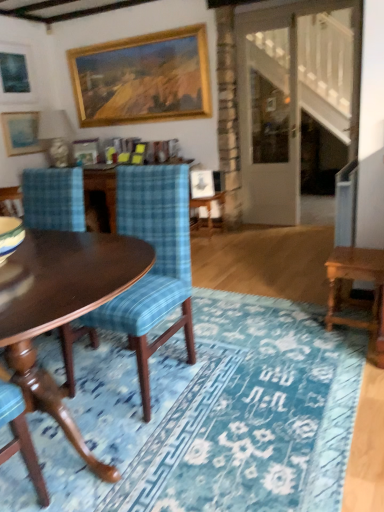
This screenshot has height=512, width=384. What do you see at coordinates (151, 269) in the screenshot? I see `blue plaid fabric chair at left` at bounding box center [151, 269].

Image resolution: width=384 pixels, height=512 pixels. What do you see at coordinates (142, 78) in the screenshot?
I see `gold-framed painting at upper center, which ranks as the 1th picture frame in right-to-left order` at bounding box center [142, 78].

Find the location of a particular element. Image resolution: width=384 pixels, height=512 pixels. wooden picture frame at upper center, which is the 2th picture frame in right-to-left order is located at coordinates (85, 151).

Where is `white glossy lampshade at upper left`? The height and width of the screenshot is (512, 384). white glossy lampshade at upper left is located at coordinates (56, 136).

Which object is thinner, white glossy lampshade at upper left or blue plaid fabric chair at left?

With smaller width is white glossy lampshade at upper left.

From a real-world perspective, is white glossy lampshade at upper left positioned under blue plaid fabric chair at left based on gravity?

No.

In the image, is white glossy lampshade at upper left on the left side or the right side of blue plaid fabric chair at left?

From the image, it's evident that white glossy lampshade at upper left is to the left of blue plaid fabric chair at left.

Is blue plaid fabric chair at left at the back of white glossy lampshade at upper left?

That's not correct — white glossy lampshade at upper left is not looking away from blue plaid fabric chair at left.

Is wooden picture frame at upper center, which is the 3th picture frame in left-to-right order, further to the viewer compared to white glossy lampshade at upper left?

Yes, wooden picture frame at upper center, which is the 3th picture frame in left-to-right order, is further from the camera.

Is point (80, 158) closer to viewer compared to point (52, 112)?

That is True.

Considering the sizes of objects wooden picture frame at upper center, which is the 2th picture frame in right-to-left order, and white glossy lampshade at upper left in the image provided, who is bigger, wooden picture frame at upper center, which is the 2th picture frame in right-to-left order, or white glossy lampshade at upper left?

white glossy lampshade at upper left is bigger.

How different are the orientations of white glossy lampshade at upper left and wooden table at right in degrees?

The angle between the facing direction of white glossy lampshade at upper left and the facing direction of wooden table at right is 4.43 degrees.

Is white glossy lampshade at upper left inside the boundaries of wooden table at right, or outside?

white glossy lampshade at upper left is outside wooden table at right.

From the image's perspective, which is below, white glossy lampshade at upper left or wooden table at right?

wooden table at right, from the image's perspective.

Considering the relative sizes of white glossy lampshade at upper left and wooden table at right in the image provided, is white glossy lampshade at upper left smaller than wooden table at right?

No.

From a real-world perspective, is wooden picture frame at upper center, which is the 3th picture frame in left-to-right order, beneath mahogany wood coffee table at lower left?

No, from a real-world perspective, wooden picture frame at upper center, which is the 3th picture frame in left-to-right order, is not under mahogany wood coffee table at lower left.

Could you tell me if wooden picture frame at upper center, which is the 3th picture frame in left-to-right order, is turned towards mahogany wood coffee table at lower left?

Yes.

I want to click on coffee table in front of the wooden picture frame at upper center, which is the 3th picture frame in left-to-right order, so click(62, 309).

Considering the sizes of objects wooden picture frame at upper center, which is the 3th picture frame in left-to-right order, and mahogany wood coffee table at lower left in the image provided, who is shorter, wooden picture frame at upper center, which is the 3th picture frame in left-to-right order, or mahogany wood coffee table at lower left?

wooden picture frame at upper center, which is the 3th picture frame in left-to-right order, is shorter.

Is white glossy lampshade at upper left facing away from wooden picture frame at upper center, which is the 2th picture frame in right-to-left order?

Yes, white glossy lampshade at upper left is positioned with its back facing wooden picture frame at upper center, which is the 2th picture frame in right-to-left order.

Looking at this image, from the image's perspective, is white glossy lampshade at upper left positioned above or below wooden picture frame at upper center, which is the 2th picture frame in right-to-left order?

From the image's perspective, white glossy lampshade at upper left appears above wooden picture frame at upper center, which is the 2th picture frame in right-to-left order.

Considering the sizes of white glossy lampshade at upper left and wooden picture frame at upper center, which is the 2th picture frame in right-to-left order, in the image, is white glossy lampshade at upper left wider or thinner than wooden picture frame at upper center, which is the 2th picture frame in right-to-left order,?

In the image, white glossy lampshade at upper left appears to be wider than wooden picture frame at upper center, which is the 2th picture frame in right-to-left order.

From a real-world perspective, relative to wooden picture frame at upper center, which is the 2th picture frame in right-to-left order, is white glossy lampshade at upper left vertically above or below?

white glossy lampshade at upper left is above wooden picture frame at upper center, which is the 2th picture frame in right-to-left order.

Is matte blue picture frame at upper left, the second picture frame positioned from the left, far from white glossy lampshade at upper left?

No, there isn't a large distance between matte blue picture frame at upper left, the second picture frame positioned from the left, and white glossy lampshade at upper left.

In the image, is matte blue picture frame at upper left, the second picture frame positioned from the left, positioned in front of or behind white glossy lampshade at upper left?

Clearly, matte blue picture frame at upper left, the second picture frame positioned from the left, is behind white glossy lampshade at upper left.

Is matte blue picture frame at upper left, placed as the 3th picture frame when sorted from right to left, facing towards white glossy lampshade at upper left?

Yes, matte blue picture frame at upper left, placed as the 3th picture frame when sorted from right to left, is facing white glossy lampshade at upper left.

At what (x,y) coordinates should I click in order to perform the action: click on the 1st picture frame above the white glossy lampshade at upper left (from the image's perspective). Please return your answer as a coordinate pair (x, y). This screenshot has width=384, height=512. Looking at the image, I should click on (21, 132).

The height and width of the screenshot is (512, 384). Find the location of `coffee table below the white glossy lampshade at upper left (from a real-world perspective)`. coffee table below the white glossy lampshade at upper left (from a real-world perspective) is located at coordinates (62, 309).

Considering the relative sizes of white glossy lampshade at upper left and mahogany wood coffee table at lower left in the image provided, is white glossy lampshade at upper left thinner than mahogany wood coffee table at lower left?

Yes.

Which is closer, (54, 154) or (47, 261)?

The point (47, 261) is in front.

Which object is further away from the camera, white glossy lampshade at upper left or mahogany wood coffee table at lower left?

white glossy lampshade at upper left is further from the camera.

You are a GUI agent. You are given a task and a screenshot of the screen. Output one action in this format:
    pyautogui.click(x=<x>, y=<y>)
    Task: Click on the chair on the right of white glossy lampshade at upper left
    This screenshot has width=384, height=512.
    Given the screenshot: What is the action you would take?
    pyautogui.click(x=151, y=269)

At what (x,y) coordinates should I click in order to perform the action: click on picture frame below the white glossy lampshade at upper left (from a real-world perspective). Please return your answer as a coordinate pair (x, y). Looking at the image, I should click on (85, 151).

Based on their spatial positions, is matte black picture frame at upper left, which appears as the fourth picture frame when viewed from the right, or blue textured rug at center closer to mahogany wood coffee table at lower left?

blue textured rug at center is positioned closer to the anchor mahogany wood coffee table at lower left.

Considering their positions, is mahogany wood coffee table at lower left positioned closer to wooden side table at center than wooden table at right?

The object closer to wooden side table at center is wooden table at right.

From the image, which object appears to be farther from blue textured rug at center, mahogany wood coffee table at lower left or wooden table at right?

The object further to blue textured rug at center is wooden table at right.

Which object lies nearer to the anchor point gold-framed painting at upper center, which ranks as the 1th picture frame in right-to-left order, blue textured rug at center or matte blue picture frame at upper left, placed as the 3th picture frame when sorted from right to left?

matte blue picture frame at upper left, placed as the 3th picture frame when sorted from right to left, is positioned closer to the anchor gold-framed painting at upper center, which ranks as the 1th picture frame in right-to-left order.

When comparing their distances from wooden table at right, does wooden side table at center or gold-framed painting at upper center, the 4th picture frame viewed from the left, seem further?

gold-framed painting at upper center, the 4th picture frame viewed from the left, is positioned further to the anchor wooden table at right.

Considering their positions, is blue textured rug at center positioned further to wooden side table at center than blue plaid fabric chair at left?

Among the two, blue textured rug at center is located further to wooden side table at center.

Considering their positions, is wooden side table at center positioned further to mahogany wood coffee table at lower left than white glossy lampshade at upper left?

The object further to mahogany wood coffee table at lower left is white glossy lampshade at upper left.

When comparing their distances from wooden picture frame at upper center, which is the 2th picture frame in right-to-left order, does mahogany wood coffee table at lower left or blue plaid fabric chair at left seem closer?

blue plaid fabric chair at left lies closer to wooden picture frame at upper center, which is the 2th picture frame in right-to-left order, than the other object.

At what (x,y) coordinates should I click in order to perform the action: click on mat located between mahogany wood coffee table at lower left and gold-framed painting at upper center, the 4th picture frame viewed from the left, in the depth direction. Please return your answer as a coordinate pair (x, y). Image resolution: width=384 pixels, height=512 pixels. Looking at the image, I should click on (214, 415).

Where is `side table positioned between blue plaid fabric chair at left and matte blue picture frame at upper left, the second picture frame positioned from the left, from near to far`? side table positioned between blue plaid fabric chair at left and matte blue picture frame at upper left, the second picture frame positioned from the left, from near to far is located at coordinates click(x=210, y=208).

Locate an element on the screen. This screenshot has height=512, width=384. mat between blue plaid fabric chair at left and wooden table at right from left to right is located at coordinates (214, 415).

Image resolution: width=384 pixels, height=512 pixels. Identify the location of table positioned between mahogany wood coffee table at lower left and matte blue picture frame at upper left, placed as the 3th picture frame when sorted from right to left, from near to far. (358, 279).